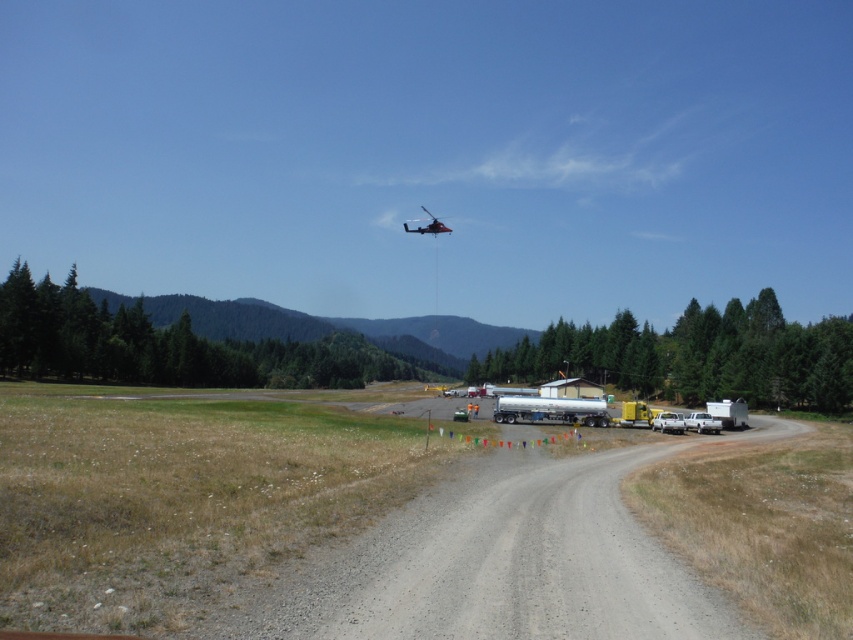
From the picture: Is silver metallic trailer truck at center to the left of metallic red helicopter at upper center from the viewer's perspective?

In fact, silver metallic trailer truck at center is to the right of metallic red helicopter at upper center.

Can you confirm if silver metallic trailer truck at center is thinner than metallic red helicopter at upper center?

Indeed, silver metallic trailer truck at center has a lesser width compared to metallic red helicopter at upper center.

Is point (508, 417) more distant than point (434, 224)?

No.

Locate an element on the screen. This screenshot has width=853, height=640. silver metallic trailer truck at center is located at coordinates (550, 410).

The image size is (853, 640). Describe the element at coordinates (508, 561) in the screenshot. I see `gray gravel road at center` at that location.

Between gray gravel road at center and metallic red helicopter at upper center, which one is positioned lower?

Positioned lower is gray gravel road at center.

Who is more distant from viewer, (x=643, y=593) or (x=425, y=232)?

The point (x=425, y=232) is more distant.

I want to click on gray gravel road at center, so click(508, 561).

From the picture: Between gray gravel road at center and silver metallic trailer truck at center, which one appears on the left side from the viewer's perspective?

gray gravel road at center

Between point (730, 438) and point (514, 420), which one is positioned behind?

Positioned behind is point (514, 420).

The width and height of the screenshot is (853, 640). I want to click on gray gravel road at center, so click(508, 561).